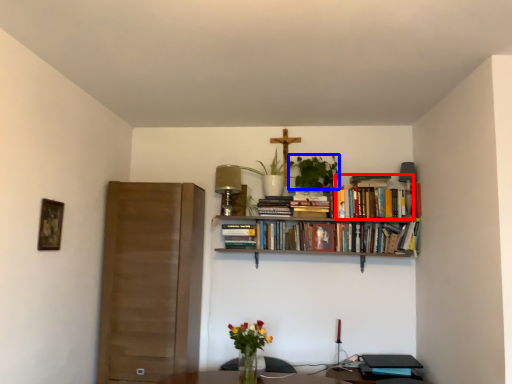
Question: Which of the following is the farthest to the observer, book (highlighted by a red box) or plant (highlighted by a blue box)?

Choices:
 (A) book
 (B) plant

Answer: (A)